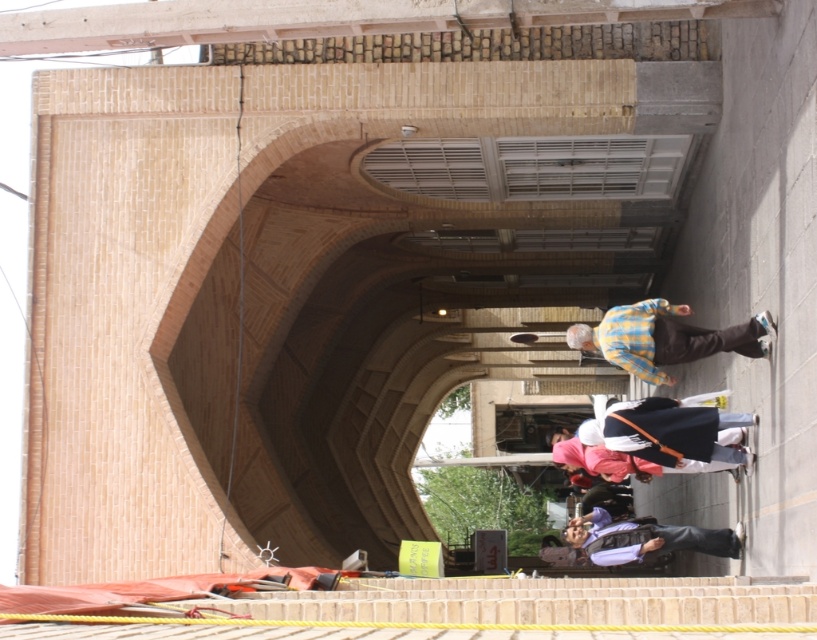
Question: Among these objects, which one is nearest to the camera?

Choices:
 (A) purple fabric pants at lower center
 (B) plaid shirt at center

Answer: (B)

Question: Is plaid shirt at center closer to camera compared to purple fabric pants at lower center?

Choices:
 (A) no
 (B) yes

Answer: (B)

Question: Is plaid shirt at center in front of purple fabric pants at lower center?

Choices:
 (A) yes
 (B) no

Answer: (A)

Question: Is the position of plaid shirt at center more distant than that of purple fabric pants at lower center?

Choices:
 (A) yes
 (B) no

Answer: (B)